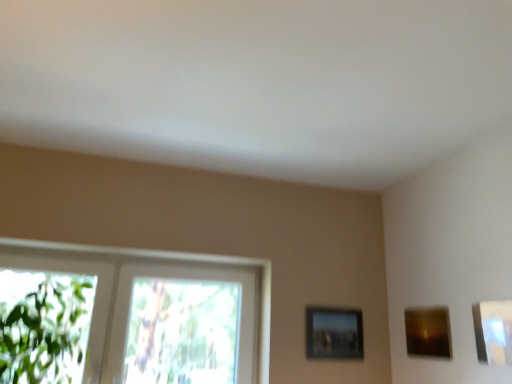
Question: Can you confirm if matte brown picture frame at upper right, which appears as the 2th picture frame when viewed from the right, is smaller than metallic silver picture frame at upper right, acting as the 3th picture frame starting from the back?

Choices:
 (A) no
 (B) yes

Answer: (A)

Question: From the image's perspective, is matte brown picture frame at upper right, positioned as the second picture frame in front-to-back order, located above metallic silver picture frame at upper right, marked as the first picture frame in a front-to-back arrangement?

Choices:
 (A) yes
 (B) no

Answer: (B)

Question: Does matte brown picture frame at upper right, which appears as the 2th picture frame when viewed from the right, have a greater width compared to metallic silver picture frame at upper right, acting as the 3th picture frame starting from the back?

Choices:
 (A) yes
 (B) no

Answer: (A)

Question: Is matte brown picture frame at upper right, positioned as the second picture frame in front-to-back order, in front of metallic silver picture frame at upper right, which is counted as the 1th picture frame, starting from the right?

Choices:
 (A) yes
 (B) no

Answer: (B)

Question: Does matte brown picture frame at upper right, which ranks as the second picture frame in back-to-front order, come behind metallic silver picture frame at upper right, marked as the first picture frame in a front-to-back arrangement?

Choices:
 (A) no
 (B) yes

Answer: (B)

Question: From the image's perspective, does matte brown picture frame at upper right, acting as the second picture frame starting from the left, appear lower than metallic silver picture frame at upper right, acting as the 3th picture frame starting from the back?

Choices:
 (A) no
 (B) yes

Answer: (B)

Question: Could you tell me if clear glass window at left is turned towards metallic silver picture frame at upper right, marked as the first picture frame in a front-to-back arrangement?

Choices:
 (A) no
 (B) yes

Answer: (A)

Question: Does clear glass window at left have a greater width compared to metallic silver picture frame at upper right, marked as the first picture frame in a front-to-back arrangement?

Choices:
 (A) yes
 (B) no

Answer: (A)

Question: Is clear glass window at left taller than metallic silver picture frame at upper right, marked as the first picture frame in a front-to-back arrangement?

Choices:
 (A) no
 (B) yes

Answer: (B)

Question: Does clear glass window at left have a larger size compared to metallic silver picture frame at upper right, marked as the first picture frame in a front-to-back arrangement?

Choices:
 (A) no
 (B) yes

Answer: (B)

Question: Is clear glass window at left shorter than metallic silver picture frame at upper right, acting as the 3th picture frame starting from the back?

Choices:
 (A) yes
 (B) no

Answer: (B)

Question: Is clear glass window at left turned away from metallic silver picture frame at upper right, arranged as the 3th picture frame when viewed from the left?

Choices:
 (A) yes
 (B) no

Answer: (B)

Question: Would you say clear glass window at left is outside matte brown picture frame at upper right, which ranks as the second picture frame in back-to-front order?

Choices:
 (A) no
 (B) yes

Answer: (B)